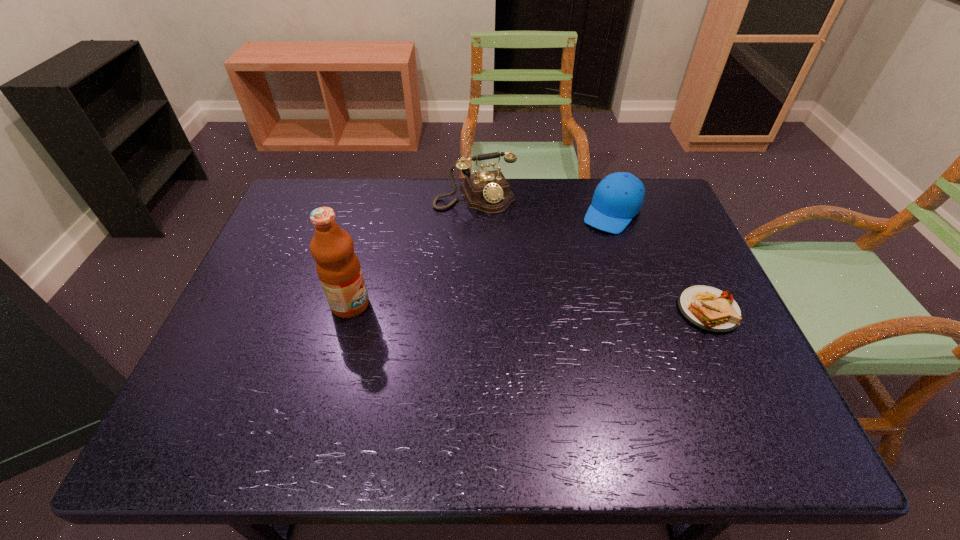
The height and width of the screenshot is (540, 960). In order to click on fruit juice in this screenshot , I will do `click(338, 267)`.

Where is `the leftmost object`? the leftmost object is located at coordinates (338, 267).

You are a GUI agent. You are given a task and a screenshot of the screen. Output one action in this format:
    pyautogui.click(x=<x>, y=<y>)
    Task: Click on the shortest object
    
    Given the screenshot: What is the action you would take?
    pyautogui.click(x=708, y=308)

Where is `cap`? The width and height of the screenshot is (960, 540). cap is located at coordinates (618, 198).

Locate an element on the screen. The image size is (960, 540). telephone is located at coordinates (489, 192).

Identify the location of the third shortest object. (489, 192).

This screenshot has width=960, height=540. Identify the location of vacant space situated 0.380m on the front label of the leftmost object. (525, 305).

You are a GUI agent. You are given a task and a screenshot of the screen. Output one action in this format:
    pyautogui.click(x=<x>, y=<y>)
    Task: Click on the vacant space located 0.280m on the back of the sandwich
    
    Given the screenshot: What is the action you would take?
    pyautogui.click(x=665, y=219)

Where is `free space located 0.320m on the front-facing side of the cap`? The width and height of the screenshot is (960, 540). free space located 0.320m on the front-facing side of the cap is located at coordinates (551, 301).

At what (x,y) coordinates should I click in order to perform the action: click on vacant position located on the front-facing side of the cap. Please return your answer as a coordinate pair (x, y). Image resolution: width=960 pixels, height=540 pixels. Looking at the image, I should click on (586, 253).